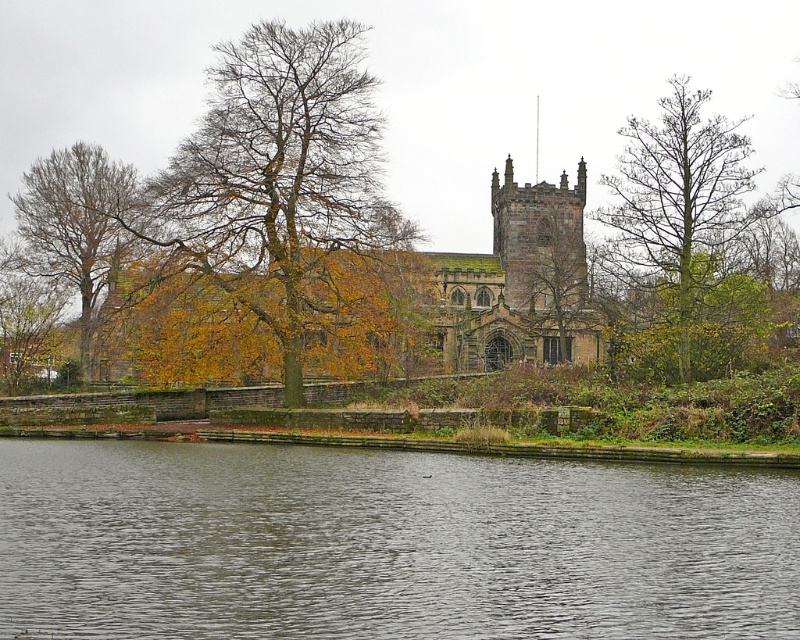
Which is in front, point (660, 369) or point (88, 163)?

Point (660, 369)

Is bare wood tree at upper center bigger than brown leafy tree at left?

Yes.

Who is more forward, (694, 104) or (117, 184)?

Point (694, 104) is more forward.

You are a GUI agent. You are given a task and a screenshot of the screen. Output one action in this format:
    pyautogui.click(x=<x>, y=<y>)
    Task: Click on the bare wood tree at upper center
    
    Given the screenshot: What is the action you would take?
    pyautogui.click(x=682, y=241)

Can you confirm if brown leafy tree at center is positioned below brown leafy tree at left?

Yes.

Does brown leafy tree at center appear on the right side of brown leafy tree at left?

Indeed, brown leafy tree at center is positioned on the right side of brown leafy tree at left.

Who is more forward, (297, 147) or (126, 209)?

Positioned in front is point (297, 147).

Where is `brown leafy tree at center`? brown leafy tree at center is located at coordinates (x=280, y=173).

Is brown leafy tree at center closer to camera compared to green leafy tree at center?

Yes, it is in front of green leafy tree at center.

Does brown leafy tree at center have a larger size compared to green leafy tree at center?

Yes, brown leafy tree at center is bigger than green leafy tree at center.

Is point (184, 189) behind point (525, 308)?

No, (184, 189) is closer to viewer.

The image size is (800, 640). I want to click on brown leafy tree at center, so click(280, 173).